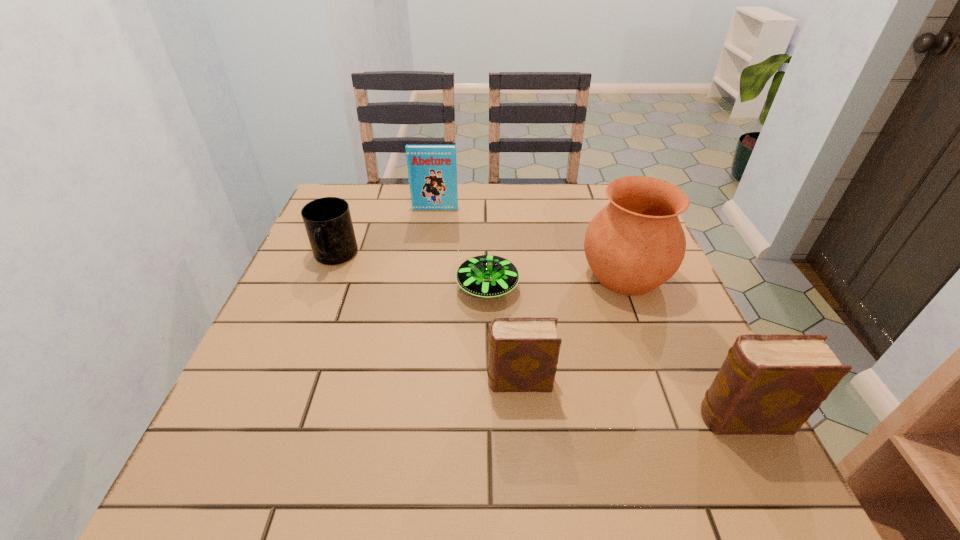
Identify the location of free spot that satisfies the following two spatial constraints: 1. on the side of the pottery with the handle; 2. on the right side of the mug. (327, 275).

This screenshot has width=960, height=540. In order to click on free location that satisfies the following two spatial constraints: 1. on the front cover of the saucer; 2. on the left side of the second object from left to right in this screenshot , I will do `click(424, 287)`.

The image size is (960, 540). In order to click on vacant space that satisfies the following two spatial constraints: 1. on the side of the mug with the handle; 2. on the right side of the shortest object in this screenshot , I will do `click(323, 287)`.

Where is `vacant position in the image that satisfies the following two spatial constraints: 1. on the side of the shortest object with the handle; 2. on the left side of the leftmost object`? vacant position in the image that satisfies the following two spatial constraints: 1. on the side of the shortest object with the handle; 2. on the left side of the leftmost object is located at coordinates (323, 287).

The image size is (960, 540). What are the coordinates of `free location that satisfies the following two spatial constraints: 1. on the front cover of the book; 2. on the left side of the pottery` in the screenshot? It's located at (426, 275).